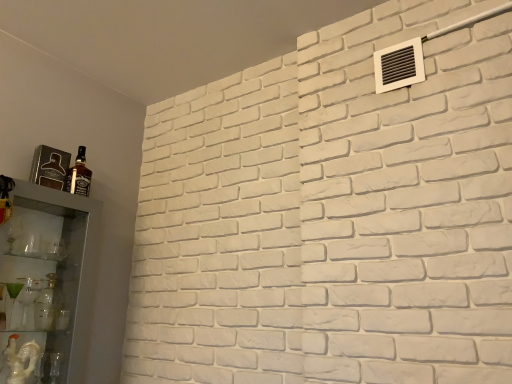
Question: Is white plastic vent at upper right bigger or smaller than matte glass bottle at left?

Choices:
 (A) big
 (B) small

Answer: (A)

Question: From a real-world perspective, is white plastic vent at upper right physically located above or below matte glass bottle at left?

Choices:
 (A) above
 (B) below

Answer: (A)

Question: Based on their relative distances, which object is nearer to the clear glass cabinet at left?

Choices:
 (A) matte glass bottle at left
 (B) white plastic vent at upper right

Answer: (A)

Question: Which of these objects is positioned closest to the matte glass bottle at left?

Choices:
 (A) white plastic vent at upper right
 (B) clear glass cabinet at left

Answer: (B)